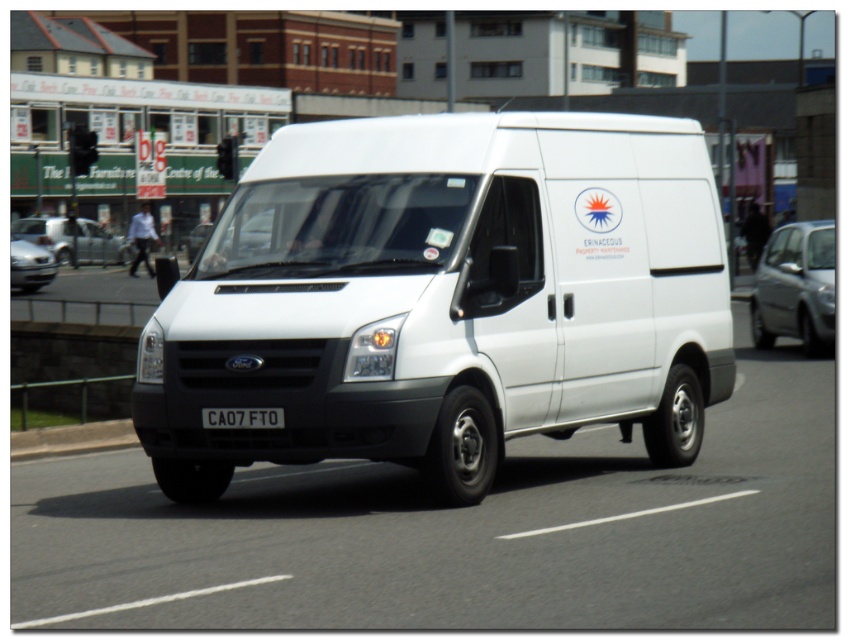
You are a traffic officer observing a white matte van at center with a black plastic license plate at center. Which object is bigger?

The white matte van at center is bigger than the black plastic license plate at center.

You are a driver in a white Ford Transit van. You want to overtake the silver metallic sedan at center and the matte black car at left. The road is straight ahead. Can you safely overtake both vehicles at once if your van requires a minimum of 10 meters to overtake?

The distance between the silver metallic sedan at center and the matte black car at left is 9.68 meters, which is less than the required 10 meters. Therefore, you cannot safely overtake both vehicles at once.